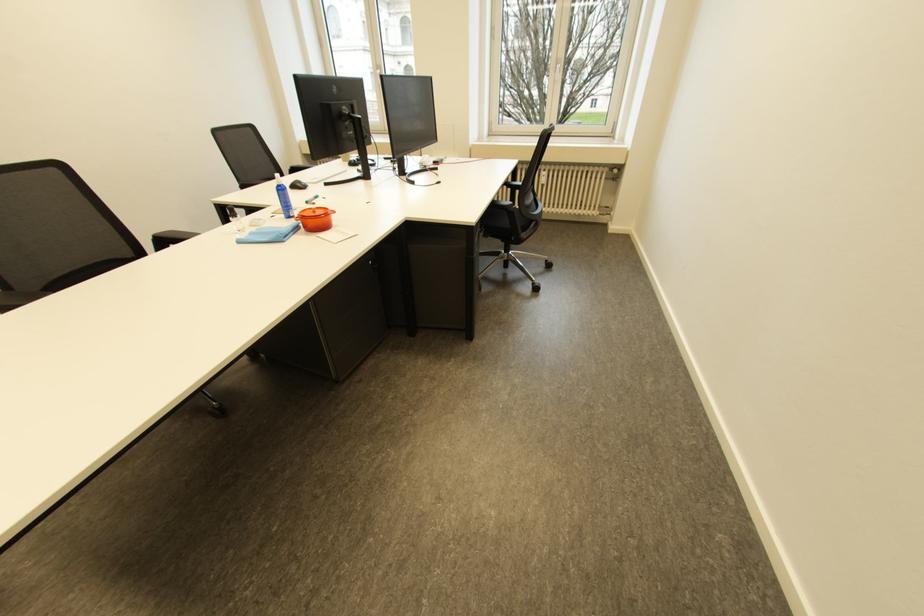
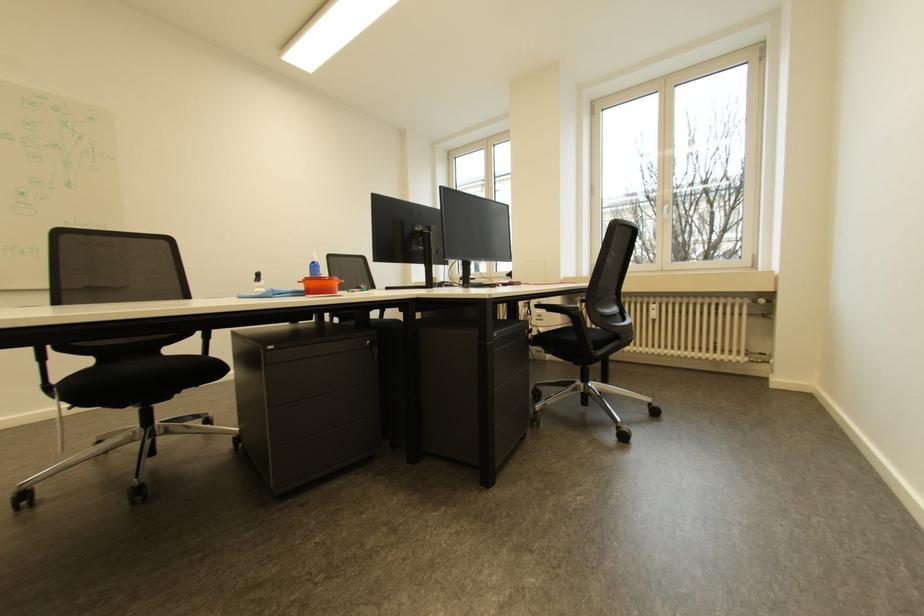
Where in the second image is the point corresponding to point 615,169 from the first image?

(757, 302)